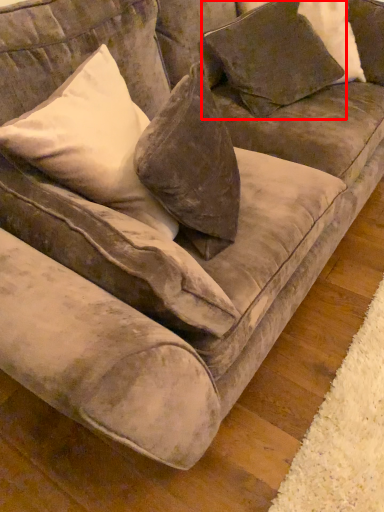
Question: From the image, what is the correct spatial relationship of pillow (annotated by the red box) in relation to pillow?

Choices:
 (A) left
 (B) right

Answer: (B)